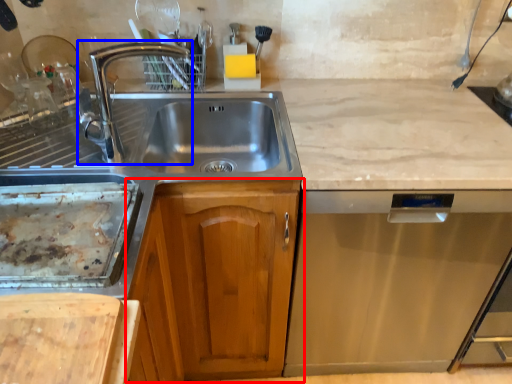
Question: Among these objects, which one is farthest to the camera, cabinetry (highlighted by a red box) or tap (highlighted by a blue box)?

Choices:
 (A) cabinetry
 (B) tap

Answer: (A)